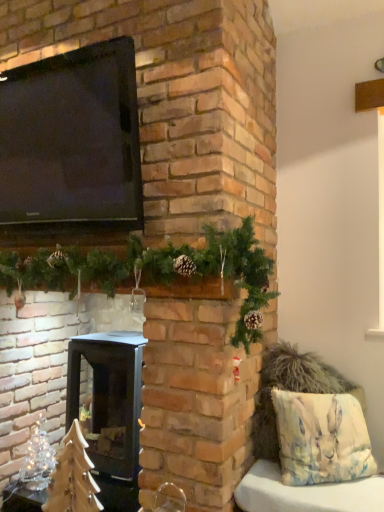
Question: Is clear glass christmas tree at lower left, the first christmas decoration viewed from the left, beside black matte wood burning stove at center?

Choices:
 (A) yes
 (B) no

Answer: (B)

Question: From the image's perspective, would you say clear glass christmas tree at lower left, the 2th christmas decoration positioned from the top, is positioned over black matte wood burning stove at center?

Choices:
 (A) no
 (B) yes

Answer: (A)

Question: Is clear glass christmas tree at lower left, the first christmas decoration in the back-to-front sequence, wider than black matte wood burning stove at center?

Choices:
 (A) yes
 (B) no

Answer: (B)

Question: From a real-world perspective, is clear glass christmas tree at lower left, which is the first christmas decoration from bottom to top, physically below black matte wood burning stove at center?

Choices:
 (A) no
 (B) yes

Answer: (B)

Question: Does clear glass christmas tree at lower left, which is the first christmas decoration from bottom to top, lie behind black matte wood burning stove at center?

Choices:
 (A) yes
 (B) no

Answer: (A)

Question: Considering the relative positions of clear glass christmas tree at lower left, the 2th christmas decoration positioned from the top, and black matte wood burning stove at center in the image provided, is clear glass christmas tree at lower left, the 2th christmas decoration positioned from the top, to the left of black matte wood burning stove at center from the viewer's perspective?

Choices:
 (A) no
 (B) yes

Answer: (B)

Question: Is black glossy tv at upper left bigger than green pinecone garland at upper center, the 2th christmas decoration from the left?

Choices:
 (A) no
 (B) yes

Answer: (A)

Question: Does black glossy tv at upper left come behind green pinecone garland at upper center, the 2th christmas decoration from the left?

Choices:
 (A) yes
 (B) no

Answer: (A)

Question: Does black glossy tv at upper left come in front of green pinecone garland at upper center, the 2th christmas decoration from the left?

Choices:
 (A) yes
 (B) no

Answer: (B)

Question: From a real-world perspective, is black glossy tv at upper left on green pinecone garland at upper center, marked as the second christmas decoration in a bottom-to-top arrangement?

Choices:
 (A) yes
 (B) no

Answer: (A)

Question: Considering the relative sizes of black glossy tv at upper left and green pinecone garland at upper center, arranged as the first christmas decoration when viewed from the right, in the image provided, is black glossy tv at upper left shorter than green pinecone garland at upper center, arranged as the first christmas decoration when viewed from the right,?

Choices:
 (A) no
 (B) yes

Answer: (A)

Question: Can you confirm if black glossy tv at upper left is smaller than green pinecone garland at upper center, marked as the 2th christmas decoration in a back-to-front arrangement?

Choices:
 (A) yes
 (B) no

Answer: (A)

Question: Are green pinecone garland at upper center, marked as the 2th christmas decoration in a back-to-front arrangement, and clear glass christmas tree at lower left, the 2th christmas decoration positioned from the top, located far from each other?

Choices:
 (A) no
 (B) yes

Answer: (B)